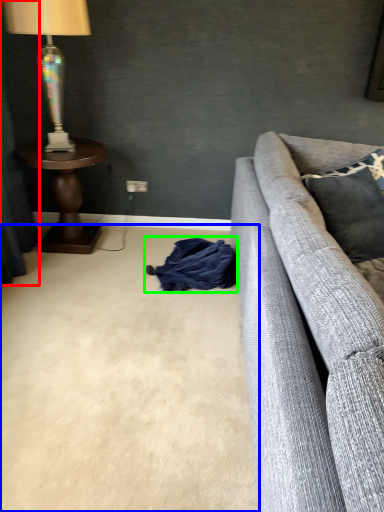
Question: Which is nearer to the curtain (highlighted by a red box)? plain (highlighted by a blue box) or material (highlighted by a green box).

Choices:
 (A) plain
 (B) material

Answer: (A)